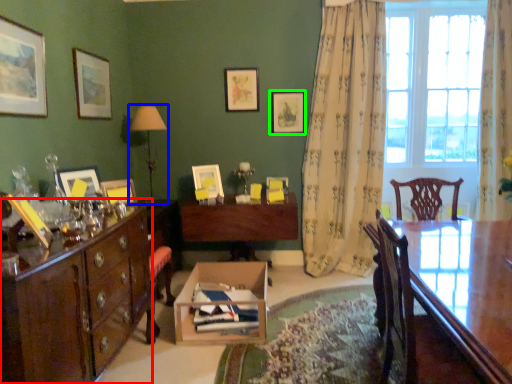
Question: Estimate the real-world distances between objects in this image. Which object is closer to cabinetry (highlighted by a red box), table lamp (highlighted by a blue box) or picture frame (highlighted by a green box)?

Choices:
 (A) table lamp
 (B) picture frame

Answer: (A)